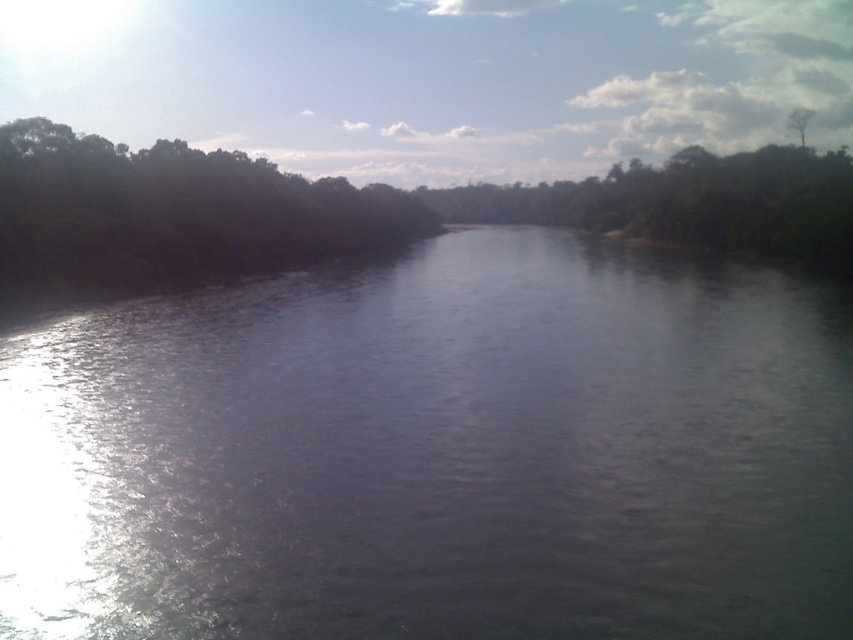
Looking at this image, who is more distant from viewer, (570, 412) or (801, 108)?

The point (801, 108) is more distant.

Is point (477, 289) behind point (793, 125)?

No, it is not.

Where is `shiny dark water at center`? The height and width of the screenshot is (640, 853). shiny dark water at center is located at coordinates (437, 452).

You are a GUI agent. You are given a task and a screenshot of the screen. Output one action in this format:
    pyautogui.click(x=<x>, y=<y>)
    Task: Click on the shiny dark water at center
    
    Given the screenshot: What is the action you would take?
    pyautogui.click(x=437, y=452)

Which of these two, dark green leafy trees at left or green leafy tree at upper right, stands shorter?

Standing shorter between the two is green leafy tree at upper right.

Between point (146, 163) and point (799, 108), which one is positioned in front?

Point (146, 163)

The image size is (853, 640). I want to click on dark green leafy trees at left, so click(172, 211).

Does shiny dark water at center lie behind dark green leafy trees at left?

No, it is not.

Identify the location of shiny dark water at center. The height and width of the screenshot is (640, 853). (437, 452).

Where is `shiny dark water at center`? shiny dark water at center is located at coordinates (437, 452).